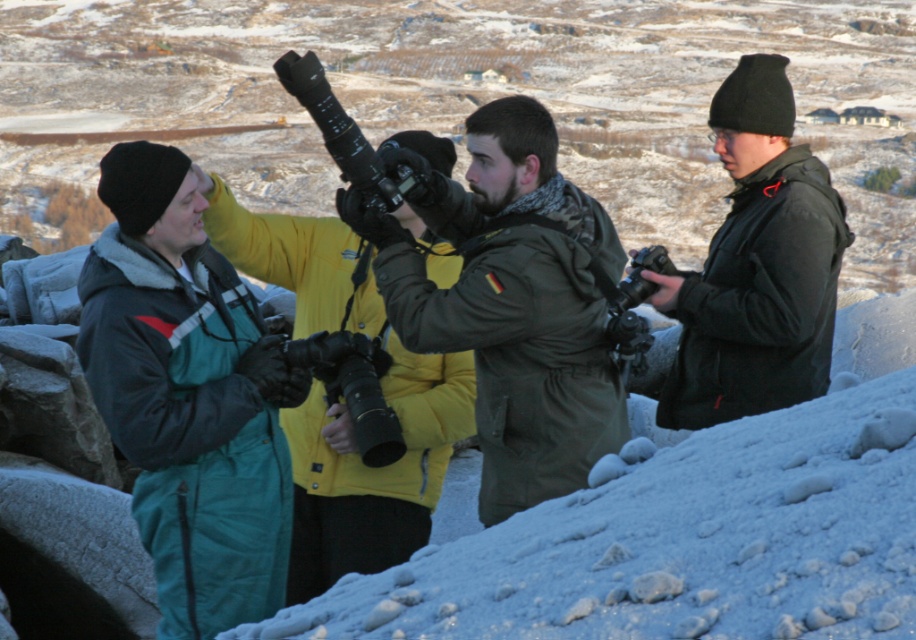
Can you confirm if yellow puffy jacket at center is taller than matte black jacket at right?

Indeed, yellow puffy jacket at center has a greater height compared to matte black jacket at right.

I want to click on yellow puffy jacket at center, so click(342, 404).

How far apart are matte green jacket at center and yellow puffy jacket at center?

They are 33.86 inches apart.

Is point (596, 424) closer to viewer compared to point (459, 362)?

Yes, it is.

From the picture: Who is more distant from viewer, (481, 129) or (409, 490)?

Point (409, 490)

Find the location of a particular element. The height and width of the screenshot is (640, 916). matte green jacket at center is located at coordinates (513, 301).

Is teal snowsuit at left behind yellow puffy jacket at center?

No.

Is teal snowsuit at left thinner than yellow puffy jacket at center?

No, teal snowsuit at left is not thinner than yellow puffy jacket at center.

Who is more distant from viewer, [213,429] or [399,211]?

Positioned behind is point [399,211].

This screenshot has width=916, height=640. I want to click on teal snowsuit at left, so click(x=188, y=396).